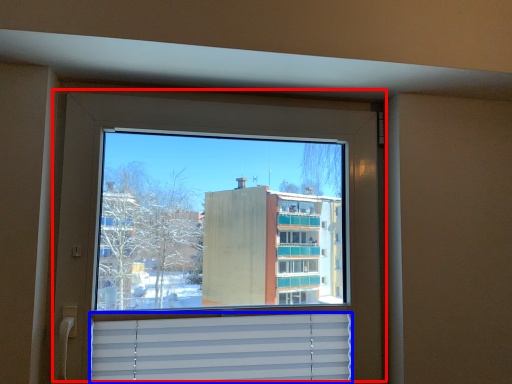
Question: Which object appears farthest to the camera in this image, window (highlighted by a red box) or shutter (highlighted by a blue box)?

Choices:
 (A) window
 (B) shutter

Answer: (B)